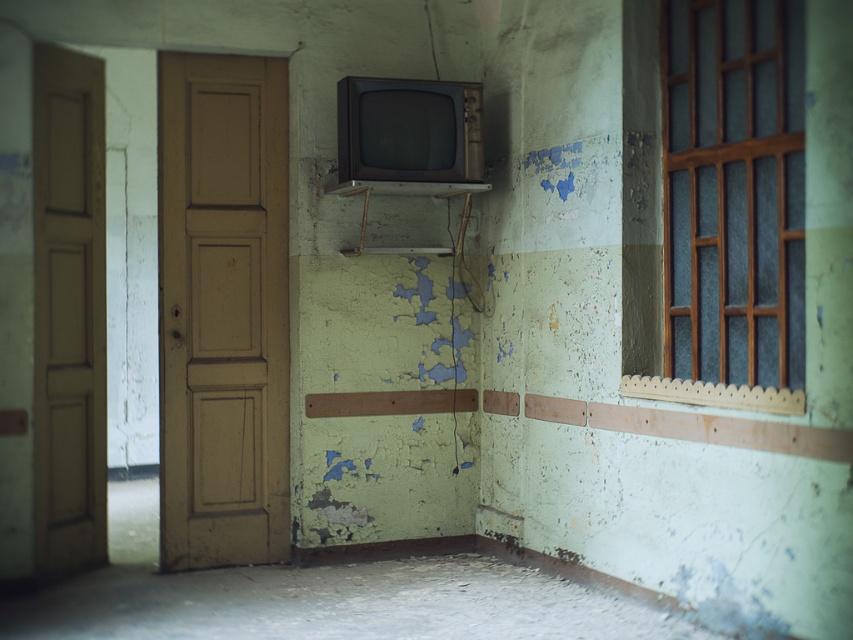
You are standing in the abandoned room and want to exit through the door. The door is located at point (68, 310). To your left, there is a brown wooden door at left. Can you walk straight from your current position to the door without any obstacles?

The brown wooden door at left is located at point (68, 310), so yes, you can walk straight to it as there are no objects mentioned blocking the path.

You are standing in the abandoned room and want to take a photo of both point [730,209] and point [454,442]. Since you can only focus on one point at a time, which point should you focus on first to ensure both are in focus?

You should focus on point [730,209] first because it is closer to the camera than point [454,442]. By focusing on the closer point, the farther point will also be within the depth of field, ensuring both are in focus.